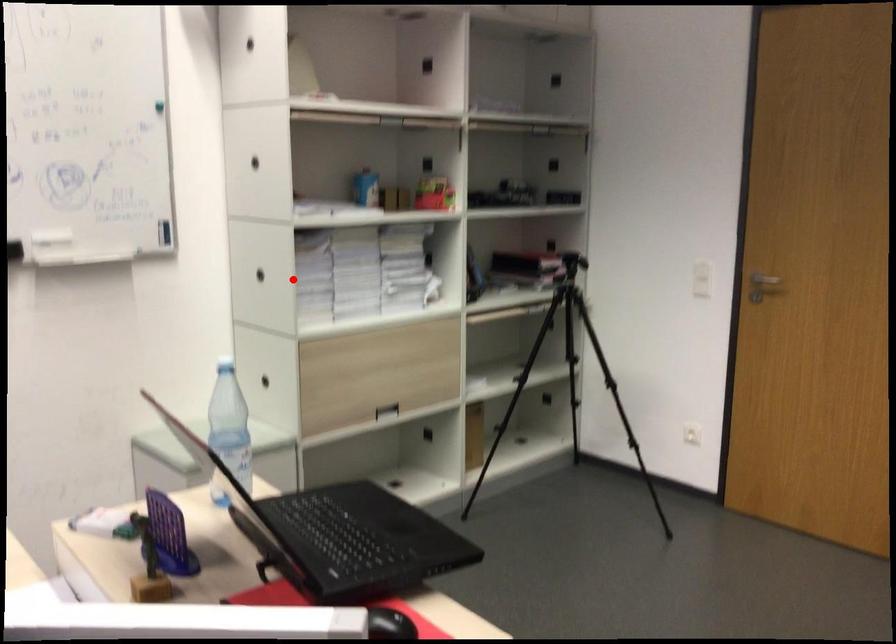
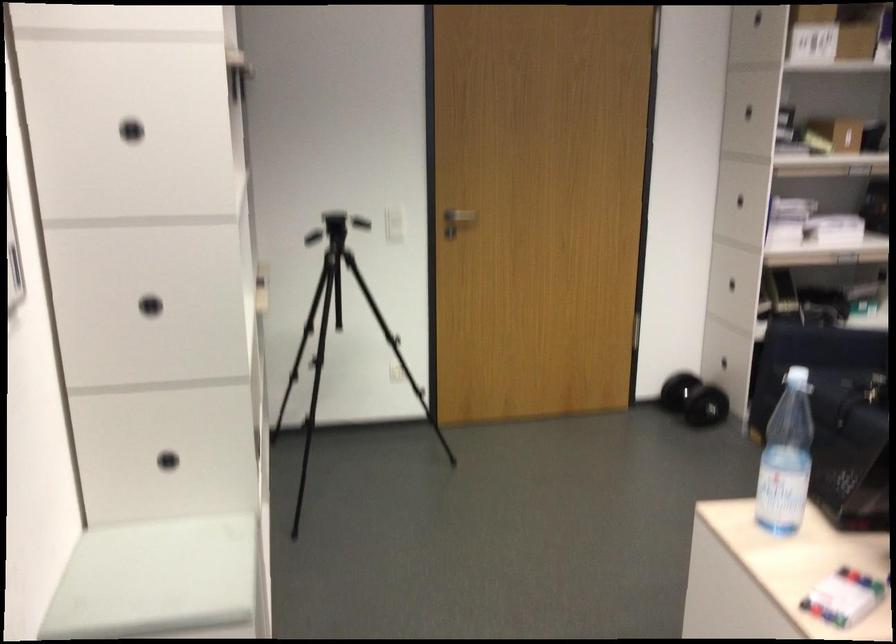
Locate, in the second image, the point that corresponds to the highlighted location in the first image.

(150, 305)